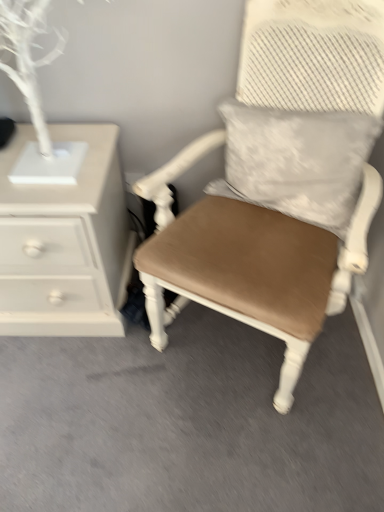
Image resolution: width=384 pixels, height=512 pixels. What do you see at coordinates (297, 161) in the screenshot?
I see `white textured pillow at upper right` at bounding box center [297, 161].

Measure the distance between matte brown cushioned chair at center and camera.

matte brown cushioned chair at center is 35.61 inches from camera.

At what (x,y) coordinates should I click in order to perform the action: click on white textured pillow at upper right. Please return your answer as a coordinate pair (x, y). Looking at the image, I should click on (297, 161).

Consider the image. From the image's perspective, relative to white textured pillow at upper right, is matte brown cushioned chair at center above or below?

matte brown cushioned chair at center is below white textured pillow at upper right.

Consider the image. How many degrees apart are the facing directions of matte brown cushioned chair at center and white textured pillow at upper right?

matte brown cushioned chair at center and white textured pillow at upper right are facing 2.81 degrees away from each other.

Is matte brown cushioned chair at center wider or thinner than white textured pillow at upper right?

Clearly, matte brown cushioned chair at center has more width compared to white textured pillow at upper right.

Is matte brown cushioned chair at center at the left side of white textured pillow at upper right?

Indeed, matte brown cushioned chair at center is positioned on the left side of white textured pillow at upper right.

How many degrees apart are the facing directions of white painted wood chest of drawers at left and white textured pillow at upper right?

25 degrees.

Is white painted wood chest of drawers at left positioned far away from white textured pillow at upper right?

Actually, white painted wood chest of drawers at left and white textured pillow at upper right are a little close together.

Between white painted wood chest of drawers at left and white textured pillow at upper right, which one has smaller size?

white textured pillow at upper right is smaller.

Based on the photo, between white painted wood chest of drawers at left and white textured pillow at upper right, which one appears on the left side from the viewer's perspective?

white painted wood chest of drawers at left is more to the left.

From the image's perspective, who appears lower, white textured pillow at upper right or white painted wood chest of drawers at left?

white painted wood chest of drawers at left is shown below in the image.

Considering the sizes of objects white textured pillow at upper right and white painted wood chest of drawers at left in the image provided, who is thinner, white textured pillow at upper right or white painted wood chest of drawers at left?

With smaller width is white textured pillow at upper right.

Is white painted wood chest of drawers at left at the back of white textured pillow at upper right?

white textured pillow at upper right is not turned away from white painted wood chest of drawers at left.

Based on the photo, how different are the orientations of white textured pillow at upper right and white painted wood chest of drawers at left in degrees?

The angular difference between white textured pillow at upper right and white painted wood chest of drawers at left is 25 degrees.

Does point (292, 344) appear closer or farther from the camera than point (70, 289)?

Point (292, 344) appears to be closer to the viewer than point (70, 289).

Is matte brown cushioned chair at center facing towards white painted wood chest of drawers at left?

No, matte brown cushioned chair at center is not facing towards white painted wood chest of drawers at left.

Between matte brown cushioned chair at center and white painted wood chest of drawers at left, which one has smaller width?

white painted wood chest of drawers at left is thinner.

Are matte brown cushioned chair at center and white painted wood chest of drawers at left beside each other?

There is a gap between matte brown cushioned chair at center and white painted wood chest of drawers at left.

Does white textured pillow at upper right touch matte brown cushioned chair at center?

Absolutely, white textured pillow at upper right is next to and touching matte brown cushioned chair at center.

Which object is closer to the camera taking this photo, white textured pillow at upper right or matte brown cushioned chair at center?

matte brown cushioned chair at center.

Where is `chair in front of the white textured pillow at upper right`? chair in front of the white textured pillow at upper right is located at coordinates (278, 181).

Image resolution: width=384 pixels, height=512 pixels. Identify the location of chest of drawers below the matte brown cushioned chair at center (from a real-world perspective). (65, 241).

From the image's perspective, is white painted wood chest of drawers at left on top of matte brown cushioned chair at center?

No, from the image's perspective, white painted wood chest of drawers at left is not above matte brown cushioned chair at center.

Which of these two, white painted wood chest of drawers at left or matte brown cushioned chair at center, is bigger?

matte brown cushioned chair at center.

Image resolution: width=384 pixels, height=512 pixels. In order to click on pillow above the matte brown cushioned chair at center (from a real-world perspective) in this screenshot , I will do `click(297, 161)`.

Identify the location of pillow in front of the white painted wood chest of drawers at left. (297, 161).

Based on their spatial positions, is matte brown cushioned chair at center or white painted wood chest of drawers at left closer to white textured pillow at upper right?

matte brown cushioned chair at center lies closer to white textured pillow at upper right than the other object.

Which object lies nearer to the anchor point matte brown cushioned chair at center, white painted wood chest of drawers at left or white textured pillow at upper right?

white textured pillow at upper right is positioned closer to the anchor matte brown cushioned chair at center.

Based on their spatial positions, is white textured pillow at upper right or matte brown cushioned chair at center closer to white painted wood chest of drawers at left?

matte brown cushioned chair at center is closer to white painted wood chest of drawers at left.

When comparing their distances from white painted wood chest of drawers at left, does matte brown cushioned chair at center or white textured pillow at upper right seem further?

white textured pillow at upper right lies further to white painted wood chest of drawers at left than the other object.

When comparing their distances from white textured pillow at upper right, does white painted wood chest of drawers at left or matte brown cushioned chair at center seem closer?

matte brown cushioned chair at center is closer to white textured pillow at upper right.

Estimate the real-world distances between objects in this image. Which object is further from matte brown cushioned chair at center, white textured pillow at upper right or white painted wood chest of drawers at left?

The object further to matte brown cushioned chair at center is white painted wood chest of drawers at left.

The width and height of the screenshot is (384, 512). I want to click on chair between white painted wood chest of drawers at left and white textured pillow at upper right from left to right, so click(x=278, y=181).